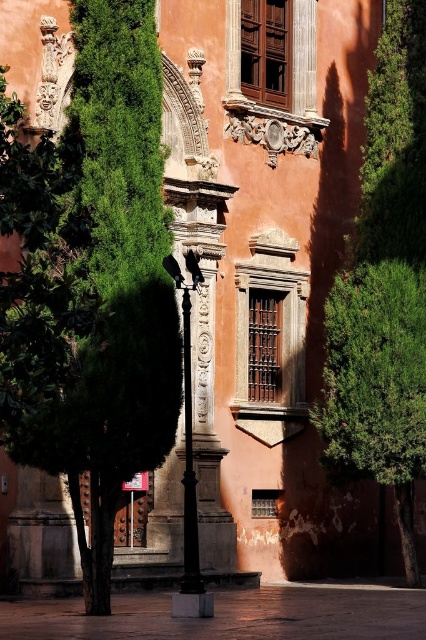
Question: Does green leafy tree at center have a larger size compared to carved stone column at center?

Choices:
 (A) yes
 (B) no

Answer: (A)

Question: Which object appears closest to the camera in this image?

Choices:
 (A) carved stone column at center
 (B) green leafy tree at right
 (C) green leafy tree at center

Answer: (C)

Question: Which point is farther to the camera?

Choices:
 (A) (72, 243)
 (B) (184, 228)
 (C) (196, 548)
 (D) (376, 305)

Answer: (B)

Question: Can you confirm if carved stone column at center is positioned to the right of polished metal pole at center?

Choices:
 (A) yes
 (B) no

Answer: (A)

Question: Among these objects, which one is nearest to the camera?

Choices:
 (A) green leafy tree at center
 (B) green leafy tree at right
 (C) polished metal pole at center

Answer: (A)

Question: Does green leafy tree at right appear on the left side of carved stone column at center?

Choices:
 (A) yes
 (B) no

Answer: (B)